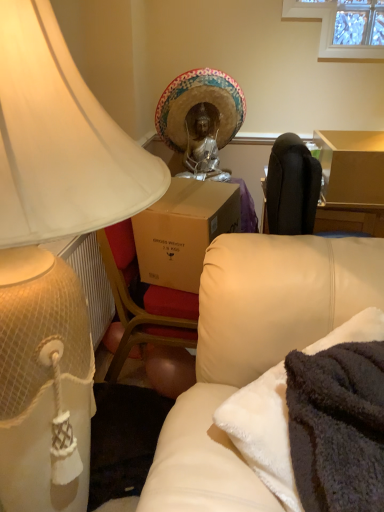
What are the coordinates of `soft cream leather couch at lower right` in the screenshot? It's located at (253, 353).

This screenshot has width=384, height=512. What do you see at coordinates (253, 353) in the screenshot?
I see `soft cream leather couch at lower right` at bounding box center [253, 353].

The height and width of the screenshot is (512, 384). I want to click on matte white lampshade at left, so 49,252.

From the image's perspective, is soft cream leather couch at lower right above or below gold textured headdress at center?

Clearly, from the image's perspective, soft cream leather couch at lower right is below gold textured headdress at center.

Does soft cream leather couch at lower right have a greater width compared to gold textured headdress at center?

Yes, soft cream leather couch at lower right is wider than gold textured headdress at center.

How many degrees apart are the facing directions of soft cream leather couch at lower right and gold textured headdress at center?

There is a 46.3-degree angle between the facing directions of soft cream leather couch at lower right and gold textured headdress at center.

How distant is soft cream leather couch at lower right from gold textured headdress at center?

soft cream leather couch at lower right and gold textured headdress at center are 4.21 feet apart.

Considering the positions of objects matte white lampshade at left and gold textured headdress at center in the image provided, who is more to the right, matte white lampshade at left or gold textured headdress at center?

gold textured headdress at center is more to the right.

Considering the sizes of objects matte white lampshade at left and gold textured headdress at center in the image provided, who is thinner, matte white lampshade at left or gold textured headdress at center?

Thinner between the two is gold textured headdress at center.

Which is closer, (8,355) or (180,75)?

Point (8,355) is closer to the camera than point (180,75).

From a real-world perspective, does matte white lampshade at left sit lower than soft cream leather couch at lower right?

Actually, matte white lampshade at left is physically above soft cream leather couch at lower right in the real world.

Between matte white lampshade at left and soft cream leather couch at lower right, which one has more height?

With more height is matte white lampshade at left.

Between matte white lampshade at left and soft cream leather couch at lower right, which one appears on the right side from the viewer's perspective?

Positioned to the right is soft cream leather couch at lower right.

Measure the distance between matte white lampshade at left and soft cream leather couch at lower right.

The distance of matte white lampshade at left from soft cream leather couch at lower right is 14.55 inches.

From the image's perspective, which is above, gold textured headdress at center or matte white lampshade at left?

gold textured headdress at center is shown above in the image.

In the scene shown: Do you think gold textured headdress at center is within matte white lampshade at left, or outside of it?

gold textured headdress at center cannot be found inside matte white lampshade at left.

Which of these two, gold textured headdress at center or soft cream leather couch at lower right, stands taller?

Standing taller between the two is gold textured headdress at center.

Considering the relative positions of gold textured headdress at center and soft cream leather couch at lower right in the image provided, is gold textured headdress at center to the left or to the right of soft cream leather couch at lower right?

From the image, it's evident that gold textured headdress at center is to the left of soft cream leather couch at lower right.

Which object is wider, gold textured headdress at center or soft cream leather couch at lower right?

soft cream leather couch at lower right is wider.

Would you say gold textured headdress at center is outside soft cream leather couch at lower right?

Indeed, gold textured headdress at center is completely outside soft cream leather couch at lower right.

Considering the points (218, 298) and (12, 50), which point is in front, point (218, 298) or point (12, 50)?

The point (12, 50) is in front.

Is soft cream leather couch at lower right not close to matte white lampshade at left?

soft cream leather couch at lower right is near matte white lampshade at left, not far away.

In the image, there is a matte white lampshade at left. At what (x,y) coordinates should I click in order to perform the action: click on studio couch below it (from a real-world perspective). Please return your answer as a coordinate pair (x, y). Looking at the image, I should click on (253, 353).

Is soft cream leather couch at lower right shorter than matte white lampshade at left?

Yes, soft cream leather couch at lower right is shorter than matte white lampshade at left.

Locate an element on the screen. This screenshot has height=512, width=384. studio couch below the gold textured headdress at center (from the image's perspective) is located at coordinates (253, 353).

I want to click on headdress on the right of matte white lampshade at left, so click(197, 103).

Looking at the image, which one is located closer to soft cream leather couch at lower right, gold textured headdress at center or matte white lampshade at left?

Based on the image, matte white lampshade at left appears to be nearer to soft cream leather couch at lower right.

Based on the photo, considering their positions, is soft cream leather couch at lower right positioned further to gold textured headdress at center than matte white lampshade at left?

Among the two, matte white lampshade at left is located further to gold textured headdress at center.

Based on their spatial positions, is soft cream leather couch at lower right or gold textured headdress at center further from matte white lampshade at left?

gold textured headdress at center lies further to matte white lampshade at left than the other object.

When comparing their distances from soft cream leather couch at lower right, does matte white lampshade at left or gold textured headdress at center seem further?

Based on the image, gold textured headdress at center appears to be further to soft cream leather couch at lower right.

From the image, which object appears to be nearer to gold textured headdress at center, matte white lampshade at left or soft cream leather couch at lower right?

soft cream leather couch at lower right is closer to gold textured headdress at center.

When comparing their distances from matte white lampshade at left, does gold textured headdress at center or soft cream leather couch at lower right seem further?

gold textured headdress at center is further to matte white lampshade at left.

You are a GUI agent. You are given a task and a screenshot of the screen. Output one action in this format:
    pyautogui.click(x=<x>, y=<y>)
    Task: Click on the studio couch located between matte white lampshade at left and gold textured headdress at center in the depth direction
    
    Given the screenshot: What is the action you would take?
    pyautogui.click(x=253, y=353)